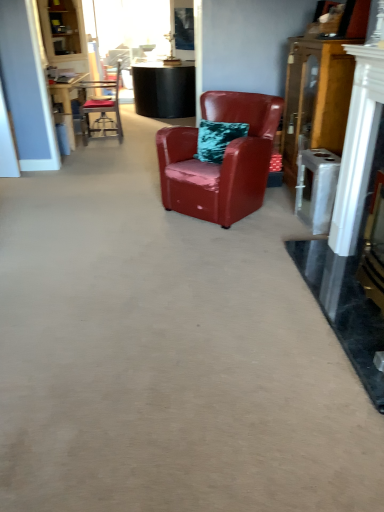
Question: From the image's perspective, is glossy leather armchair at center, which appears as the 2th chair when viewed from the back, positioned above or below wooden cabinet at right?

Choices:
 (A) below
 (B) above

Answer: (A)

Question: Is glossy leather armchair at center, which appears as the 2th chair when viewed from the back, bigger or smaller than wooden cabinet at right?

Choices:
 (A) big
 (B) small

Answer: (A)

Question: Which object is the closest to the glossy leather armchair at center, positioned as the first chair in front-to-back order?

Choices:
 (A) metallic silver chair at upper left, which appears as the first chair when viewed from the left
 (B) wooden cabinet at right

Answer: (B)

Question: Estimate the real-world distances between objects in this image. Which object is closer to the glossy leather armchair at center, which is the 1th chair in bottom-to-top order?

Choices:
 (A) metallic silver chair at upper left, which is the second chair in right-to-left order
 (B) wooden cabinet at right

Answer: (B)